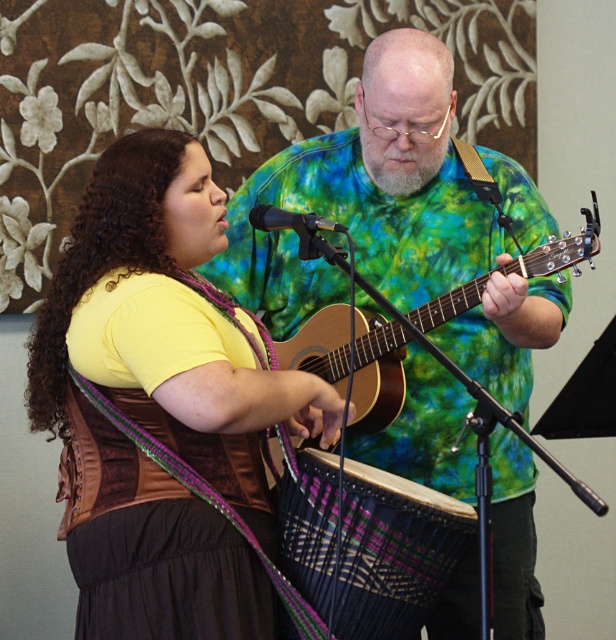
Consider the image. Is brown leather vest at center thinner than grayish-green beard at center?

In fact, brown leather vest at center might be wider than grayish-green beard at center.

Between brown leather vest at center and grayish-green beard at center, which one has less height?

With less height is grayish-green beard at center.

Is point (182, 358) behind point (395, 156)?

No, it is in front of (395, 156).

The height and width of the screenshot is (640, 616). In order to click on brown leather vest at center in this screenshot , I will do `click(161, 404)`.

Does black woven drum at center have a lesser height compared to grayish-green beard at center?

No, black woven drum at center is not shorter than grayish-green beard at center.

Is point (346, 570) farther from viewer compared to point (371, 161)?

No.

At what (x,y) coordinates should I click in order to perform the action: click on black woven drum at center. Please return your answer as a coordinate pair (x, y). Image resolution: width=616 pixels, height=640 pixels. Looking at the image, I should click on (394, 552).

Is green tie-dye shirt at center smaller than black woven drum at center?

Actually, green tie-dye shirt at center might be larger than black woven drum at center.

Is green tie-dye shirt at center behind black woven drum at center?

Yes, green tie-dye shirt at center is further from the viewer.

Does point (496, 394) come in front of point (320, 612)?

No, (496, 394) is behind (320, 612).

Locate an element on the screen. This screenshot has width=616, height=640. green tie-dye shirt at center is located at coordinates (365, 202).